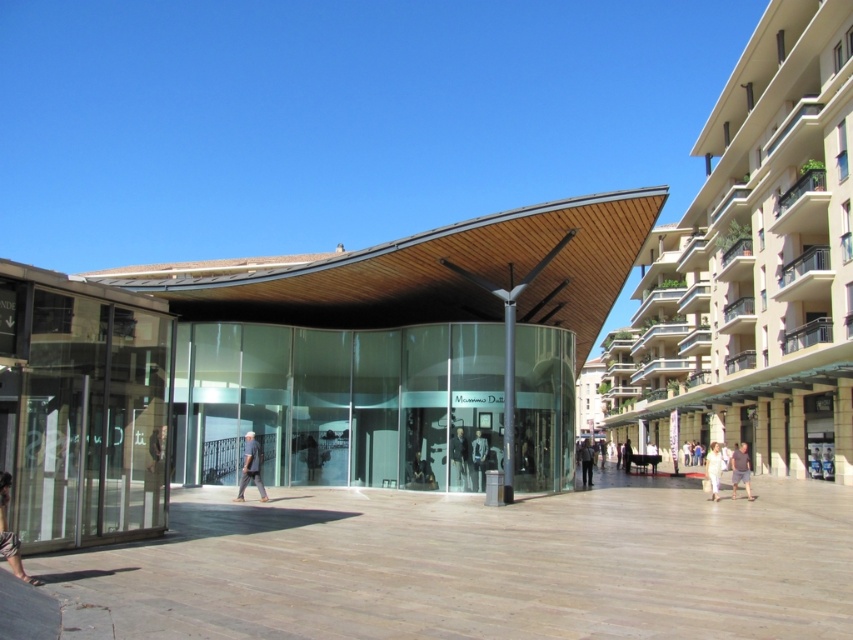
Does white fabric person at center appear over dark brown leather jacket at center?

No, white fabric person at center is not above dark brown leather jacket at center.

Looking at this image, which is more to the left, white fabric person at center or dark brown leather jacket at center?

dark brown leather jacket at center

Where is `white fabric person at center`? white fabric person at center is located at coordinates (712, 468).

Between light brown leather shoes at lower left and dark gray fabric mannequin at center, which one is positioned higher?

light brown leather shoes at lower left is above.

Between point (15, 548) and point (479, 465), which one is positioned in front?

Point (15, 548) is more forward.

Find the location of a particular element. light brown leather shoes at lower left is located at coordinates (10, 532).

Is beige stone building at center positioned in front of white fabric person at center?

Yes.

Which is in front, point (718, 99) or point (717, 486)?

Point (717, 486)

Find the location of `beige stone building at center`. beige stone building at center is located at coordinates (759, 262).